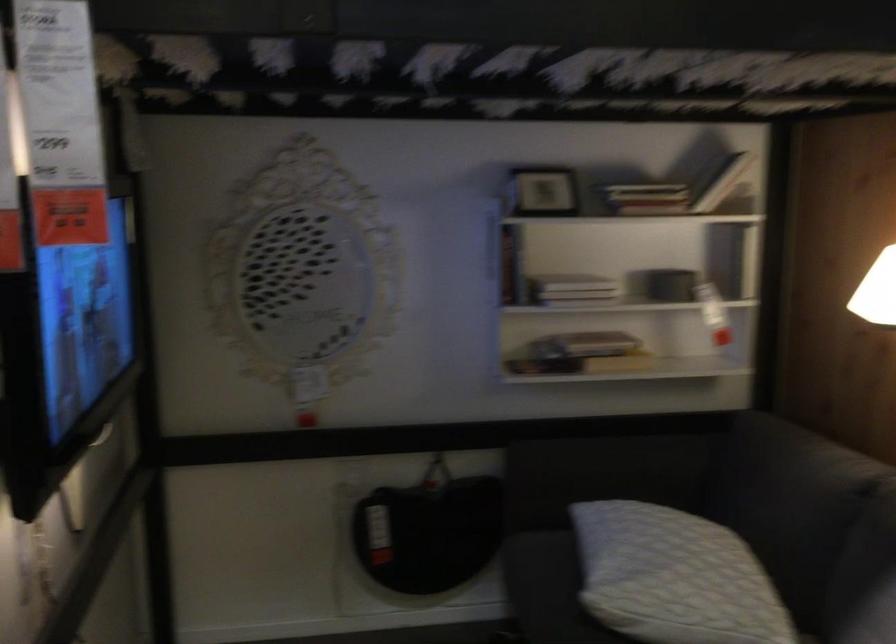
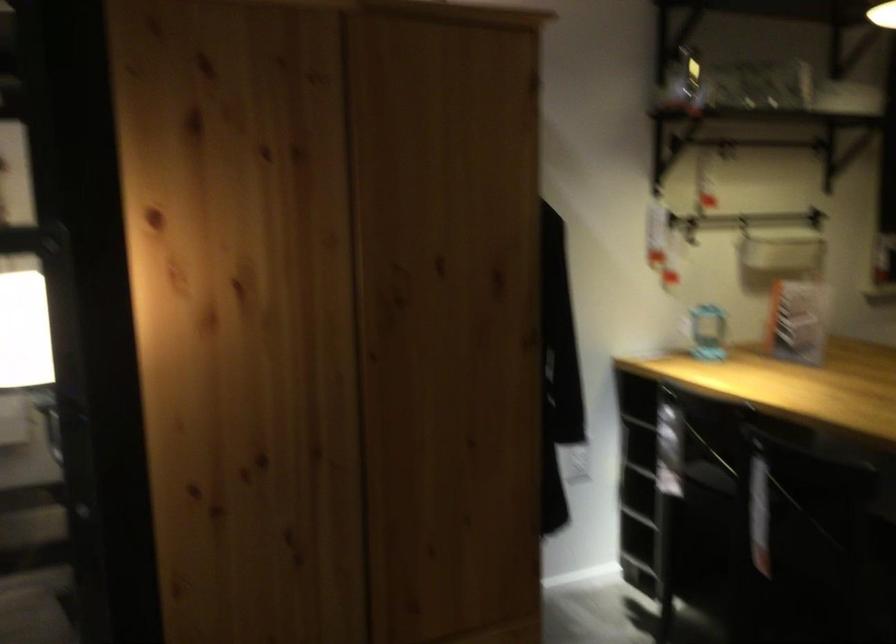
Question: Which direction would the cameraman need to move to produce the second image? Reply with the corresponding letter.

Choices:
 (A) Left
 (B) Right
 (C) Forward
 (D) Backward

Answer: (B)